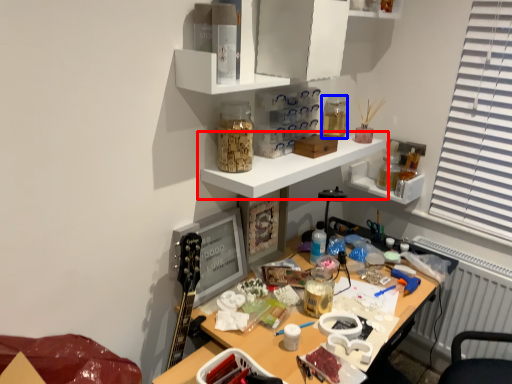
Question: Which of the following is the farthest to the observer, shelf (highlighted by a red box) or stationery (highlighted by a blue box)?

Choices:
 (A) shelf
 (B) stationery

Answer: (B)